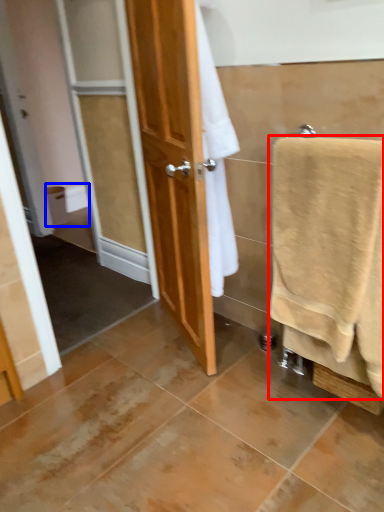
Question: Which point is further to the camera, towel (highlighted by a red box) or toilet paper (highlighted by a blue box)?

Choices:
 (A) towel
 (B) toilet paper

Answer: (B)